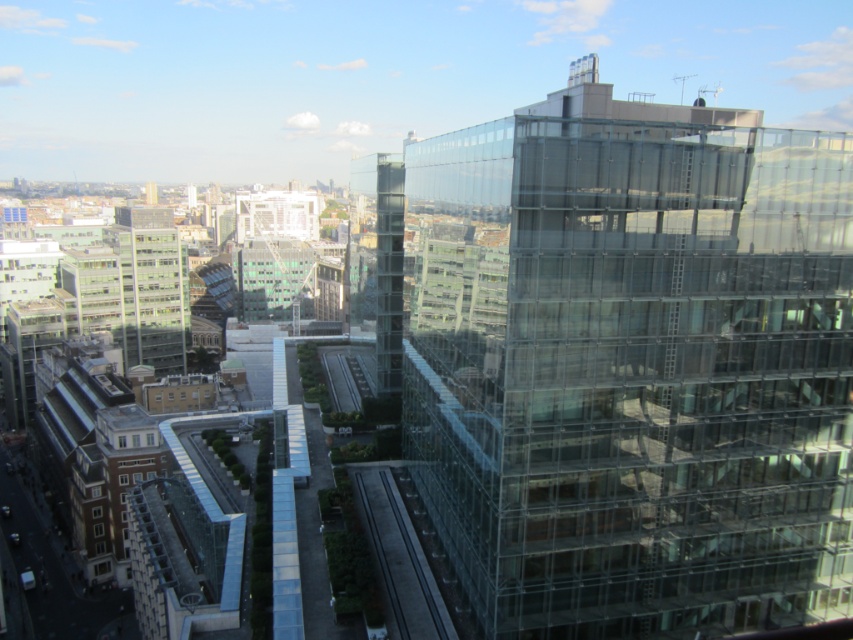
You are an architect evaluating the urban layout. Given the transparent glass building at right and the transparent glass elevator at center, which one has a greater horizontal span from left to right? Please base your answer on their widths.

The transparent glass building at right has a greater horizontal span from left to right than the transparent glass elevator at center because its width surpasses the elevator.

You are a visitor standing in the middle of the urban landscape. You see the transparent glass building at right and the transparent glass elevator at center. Which one appears taller from your vantage point?

The transparent glass building at right is much taller than the transparent glass elevator at center, so it appears taller from your vantage point.